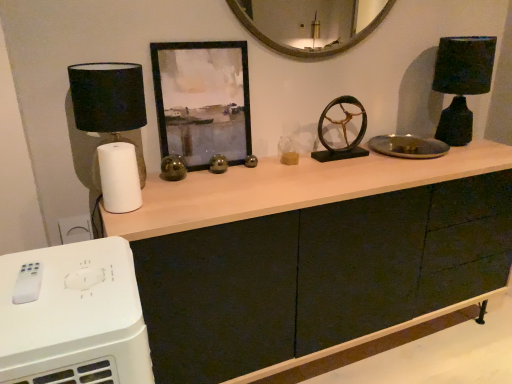
This screenshot has height=384, width=512. In order to click on free space on the front side of bronze metallic wheel at center in this screenshot , I will do `click(352, 170)`.